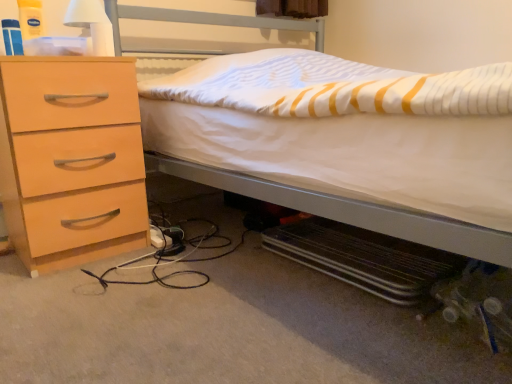
Question: In the image, is white matte bed at center on the left side or the right side of light wood/finish chest of drawers at left?

Choices:
 (A) left
 (B) right

Answer: (B)

Question: From their relative heights in the image, would you say white matte bed at center is taller or shorter than light wood/finish chest of drawers at left?

Choices:
 (A) tall
 (B) short

Answer: (A)

Question: Which is farther from the white matte bed at center?

Choices:
 (A) light wood/finish chest of drawers at left
 (B) white matte lampshade at upper left

Answer: (B)

Question: Which of these objects is positioned closest to the light wood/finish chest of drawers at left?

Choices:
 (A) white matte lampshade at upper left
 (B) white matte bed at center

Answer: (A)